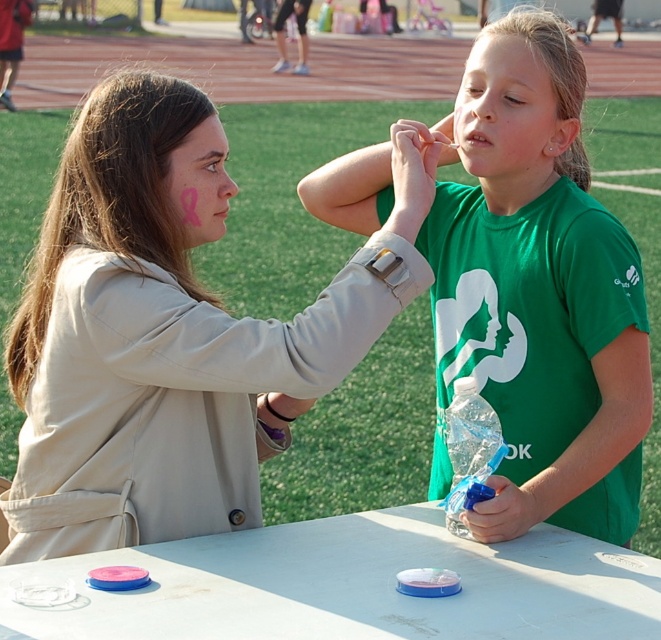
Question: Based on their relative distances, which object is farther from the green matte shirt at center?

Choices:
 (A) matte green shirt at center
 (B) matte beige jacket at upper left
 (C) pink matte face paint at upper center

Answer: (C)

Question: Can you confirm if white plastic picnic table at center is positioned below pink matte face paint at upper center?

Choices:
 (A) no
 (B) yes

Answer: (B)

Question: Which object appears closest to the camera in this image?

Choices:
 (A) matte green shirt at center
 (B) matte beige jacket at upper left

Answer: (B)

Question: Does pink matte ribbon at left appear on the right side of pink matte face paint at upper center?

Choices:
 (A) no
 (B) yes

Answer: (A)

Question: Can you confirm if matte beige jacket at upper left is positioned to the right of pink matte ribbon at left?

Choices:
 (A) no
 (B) yes

Answer: (A)

Question: Which point appears farthest from the camera in this image?

Choices:
 (A) (139, 333)
 (B) (572, 154)

Answer: (B)